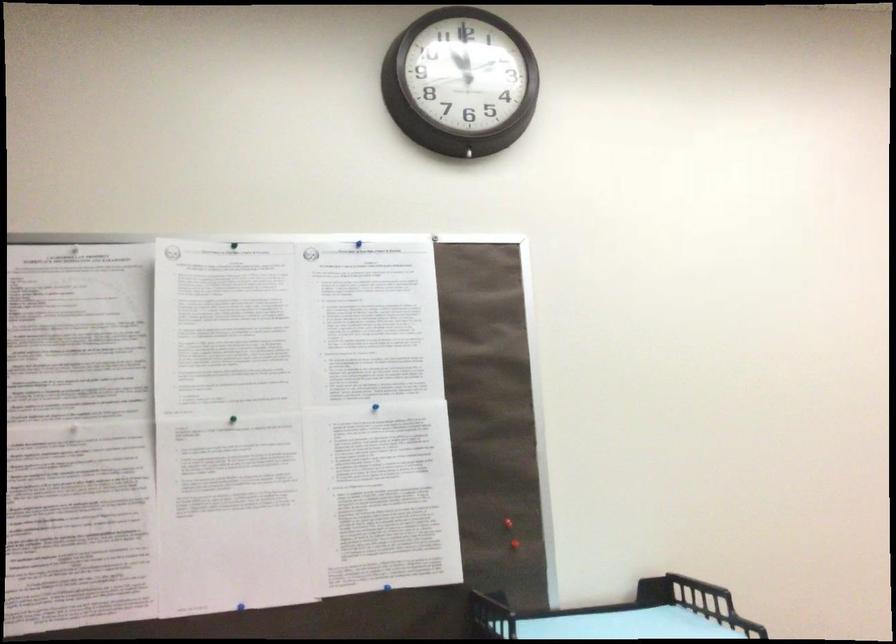
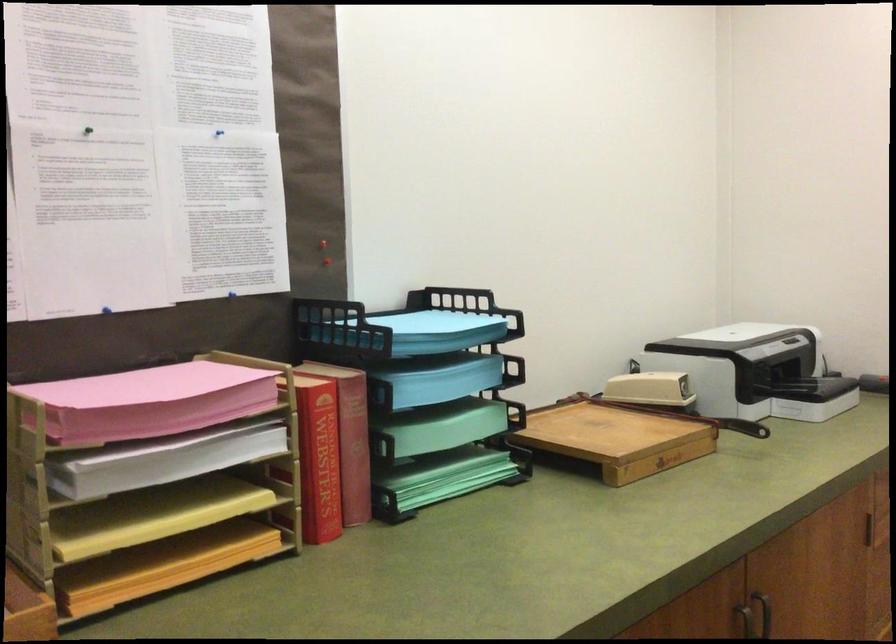
Question: Based on the continuous images, in which direction is the camera rotating? Reply with the corresponding letter.

Choices:
 (A) Left
 (B) Right
 (C) Up
 (D) Down

Answer: (B)